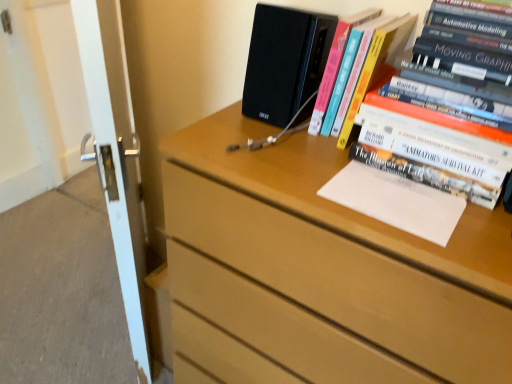
At what (x,y) coordinates should I click in order to perform the action: click on blank space situated above white paper at upper right (from a real-world perspective). Please return your answer as a coordinate pair (x, y). Looking at the image, I should click on (391, 189).